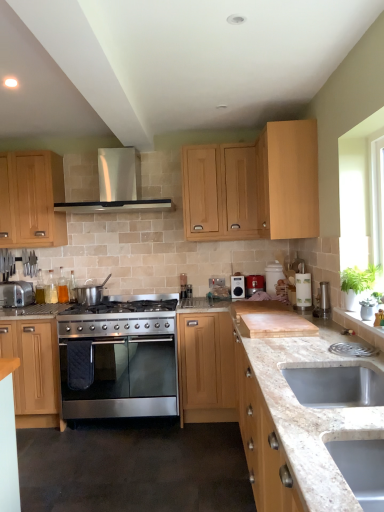
Question: Is translucent glass bottles at left, the 5th appliance positioned from the right, inside the boundaries of light wood cabinet at upper center, which appears as the 2th cabinetry when viewed from the right, or outside?

Choices:
 (A) outside
 (B) inside

Answer: (A)

Question: Visually, is translucent glass bottles at left, arranged as the 1th appliance when viewed from the back, positioned to the left or to the right of light wood cabinet at upper center, which appears as the 2th cabinetry when viewed from the right?

Choices:
 (A) right
 (B) left

Answer: (B)

Question: Which of these objects is positioned closest to the translucent glass bottles at left, arranged as the 1th appliance when viewed from the back?

Choices:
 (A) stainless steel gas stove at center
 (B) metallic silver toaster at center, the fourth appliance when ordered from front to back
 (C) satin silver pot at center, the 3th appliance viewed from the left
 (D) light wood/texture cabinet at center, the third cabinetry positioned from the right
 (E) light wood cabinet at upper center, which appears as the 2th cabinetry when viewed from the right

Answer: (C)

Question: Estimate the real-world distances between objects in this image. Which object is farther from the satin silver pot at center, the 4th appliance when ordered from right to left?

Choices:
 (A) stainless steel oven at center
 (B) light wood cabinet at upper right, which is the 5th cabinetry from left to right
 (C) matte wood cabinet at left, the second cabinetry viewed from the left
 (D) translucent glass bottles at left, arranged as the 2th appliance when viewed from the left
 (E) light wood/texture cabinet at center, positioned as the third cabinetry in left-to-right order

Answer: (B)